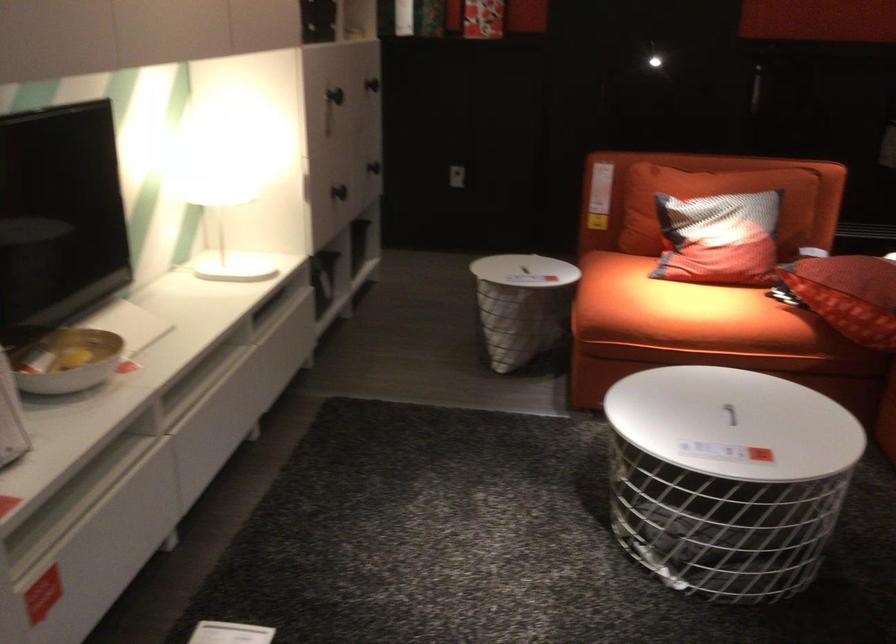
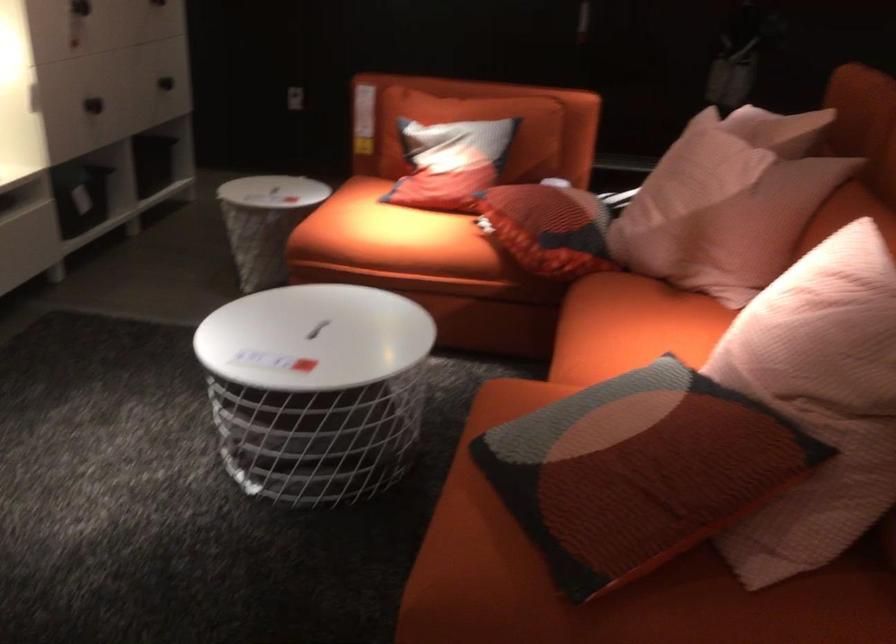
Question: What movement of the cameraman would produce the second image?

Choices:
 (A) Left
 (B) Right
 (C) Forward
 (D) Backward

Answer: (B)